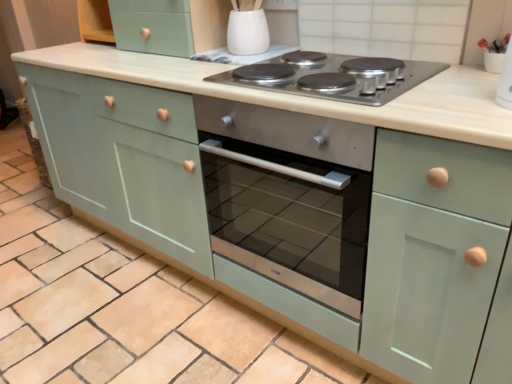
Question: Is white glossy vase at upper center not within stainless steel cooktop at center?

Choices:
 (A) no
 (B) yes

Answer: (B)

Question: Considering the relative positions of white glossy vase at upper center and stainless steel cooktop at center in the image provided, is white glossy vase at upper center to the right of stainless steel cooktop at center from the viewer's perspective?

Choices:
 (A) yes
 (B) no

Answer: (B)

Question: Is white glossy vase at upper center shorter than stainless steel cooktop at center?

Choices:
 (A) yes
 (B) no

Answer: (B)

Question: Is white glossy vase at upper center wider than stainless steel cooktop at center?

Choices:
 (A) yes
 (B) no

Answer: (B)

Question: From a real-world perspective, is white glossy vase at upper center below stainless steel cooktop at center?

Choices:
 (A) yes
 (B) no

Answer: (B)

Question: Is white glossy vase at upper center positioned before stainless steel cooktop at center?

Choices:
 (A) no
 (B) yes

Answer: (A)

Question: Is the position of stainless steel cooktop at center more distant than that of white glossy vase at upper center?

Choices:
 (A) yes
 (B) no

Answer: (B)

Question: Is stainless steel cooktop at center facing away from white glossy vase at upper center?

Choices:
 (A) no
 (B) yes

Answer: (A)

Question: Is stainless steel cooktop at center not close to white glossy vase at upper center?

Choices:
 (A) no
 (B) yes

Answer: (A)

Question: Is stainless steel cooktop at center bigger than white glossy vase at upper center?

Choices:
 (A) yes
 (B) no

Answer: (A)

Question: Is stainless steel cooktop at center facing towards white glossy vase at upper center?

Choices:
 (A) no
 (B) yes

Answer: (A)

Question: From a real-world perspective, is stainless steel cooktop at center below white glossy vase at upper center?

Choices:
 (A) yes
 (B) no

Answer: (A)

Question: From a real-world perspective, is stainless steel cooktop at center positioned above or below white glossy vase at upper center?

Choices:
 (A) above
 (B) below

Answer: (B)